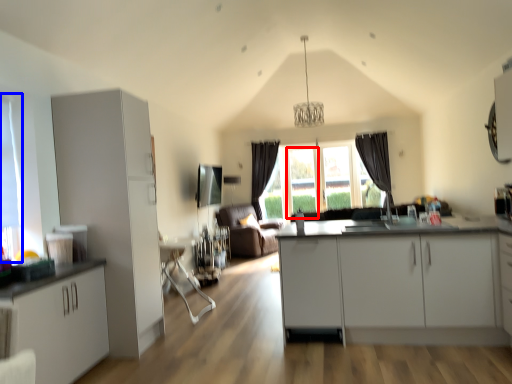
Question: Among these objects, which one is nearest to the camera, glass door (highlighted by a red box) or window (highlighted by a blue box)?

Choices:
 (A) glass door
 (B) window

Answer: (B)